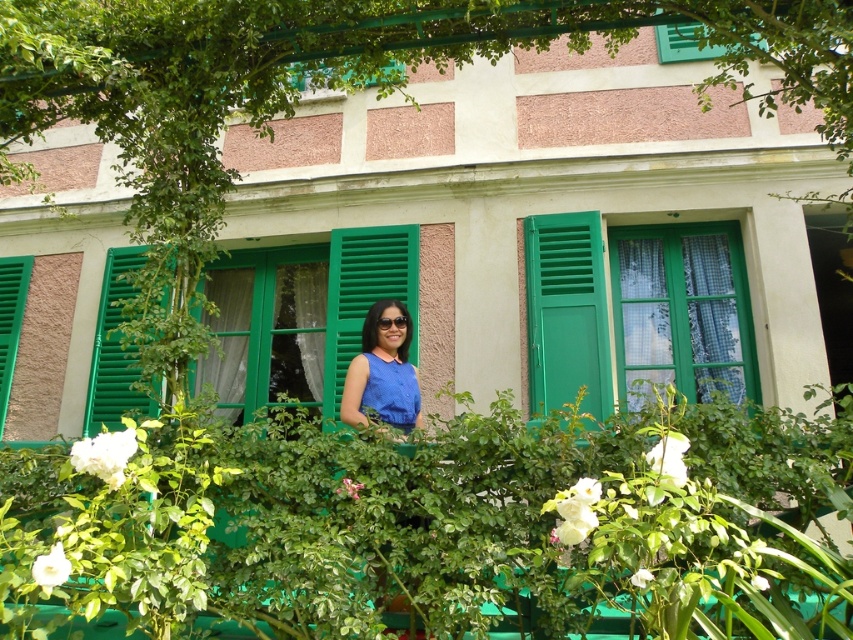
Who is more forward, (136, 250) or (381, 387)?

Positioned in front is point (381, 387).

Looking at this image, is green matte shutter at left smaller than blue matte dress at center?

No.

Is point (109, 273) closer to viewer compared to point (368, 369)?

No, (109, 273) is further to viewer.

At what (x,y) coordinates should I click in order to perform the action: click on green matte shutter at left. Please return your answer as a coordinate pair (x, y). Looking at the image, I should click on (115, 349).

Consider the image. Is green matte window at center wider than green matte shutter at left?

Correct, the width of green matte window at center exceeds that of green matte shutter at left.

What do you see at coordinates (682, 310) in the screenshot? I see `green matte window at center` at bounding box center [682, 310].

Locate an element on the screen. green matte window at center is located at coordinates (682, 310).

Is point (578, 378) farther from camera compared to point (339, 380)?

No, (578, 378) is closer to viewer.

Which is in front, point (709, 236) or point (229, 362)?

Point (709, 236) is in front.

Where is `green matte window at center`? The image size is (853, 640). green matte window at center is located at coordinates (682, 310).